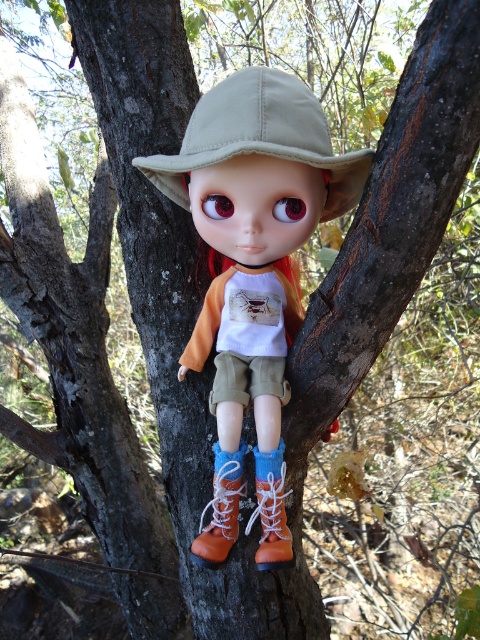
You are a photographer trying to capture the doll between two tree trunks. You notice two hats on the doll, the matte khaki hat at center and the khaki fabric hat at center. Which hat is wider?

The khaki fabric hat at center is wider than the matte khaki hat at center.

You are standing in a forest and see two points marked in the image. Which point, point (228, 92) or point (357, 202), is closer to you?

Point (228, 92) is closer to the viewer than point (357, 202).

You are a hiker who wants to place both the matte khaki hat at center and the khaki fabric hat at center on a shelf. The shelf has limited vertical space. Which hat should you place on top to ensure both fit vertically?

You should place the khaki fabric hat at center on top since the matte khaki hat at center is below it, meaning the fabric hat is taller and requires more vertical space.